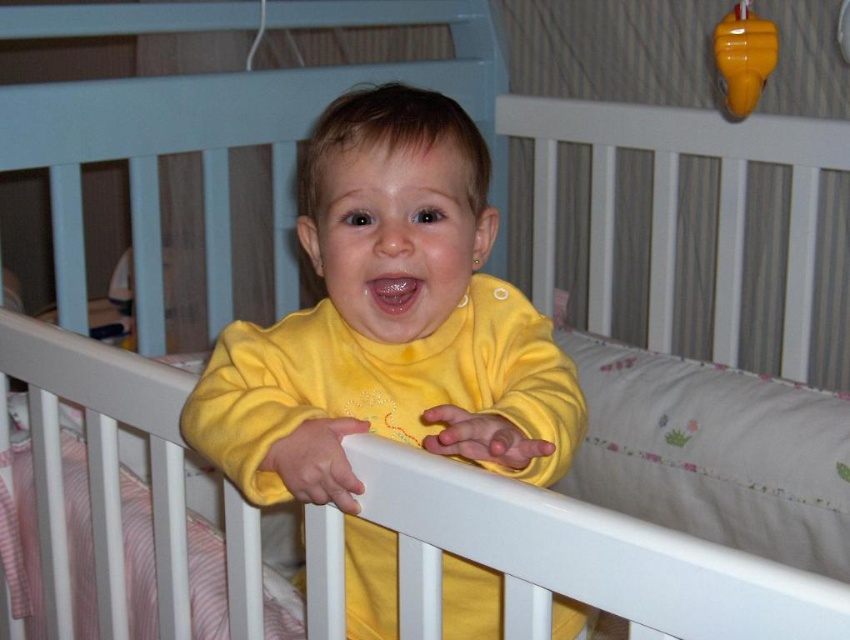
Is the position of yellow fleece baby at center less distant than that of shiny yellow rattle at upper right?

Yes.

In the scene shown: Does yellow fleece baby at center appear on the left side of shiny yellow rattle at upper right?

Indeed, yellow fleece baby at center is positioned on the left side of shiny yellow rattle at upper right.

Identify the location of yellow fleece baby at center. (388, 337).

You are a GUI agent. You are given a task and a screenshot of the screen. Output one action in this format:
    pyautogui.click(x=<x>, y=<y>)
    Task: Click on the yellow fleece baby at center
    This screenshot has height=640, width=850.
    Given the screenshot: What is the action you would take?
    pyautogui.click(x=388, y=337)